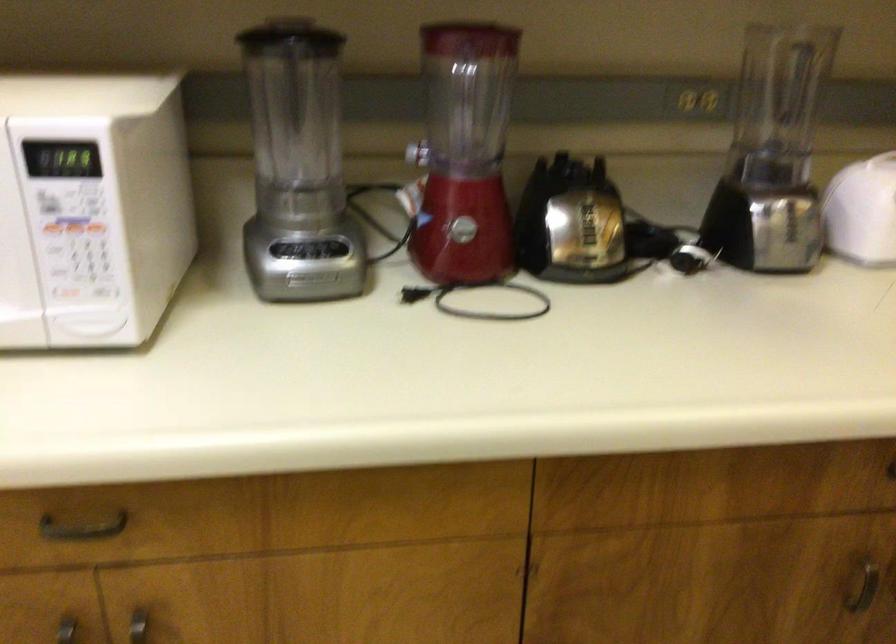
Describe the element at coordinates (74, 242) in the screenshot. The image size is (896, 644). I see `a microwave button panel` at that location.